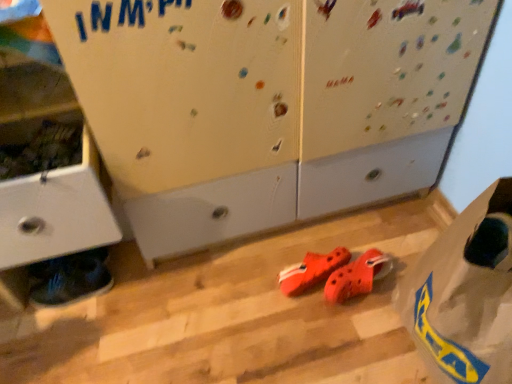
You are a GUI agent. You are given a task and a screenshot of the screen. Output one action in this format:
    pyautogui.click(x=<x>, y=<y>)
    Task: Click on the free space that is to the left of rubber/crocodile-patterned shoes at center, the 2th footwear positioned from the left
    This screenshot has height=384, width=512.
    Given the screenshot: What is the action you would take?
    pyautogui.click(x=247, y=286)